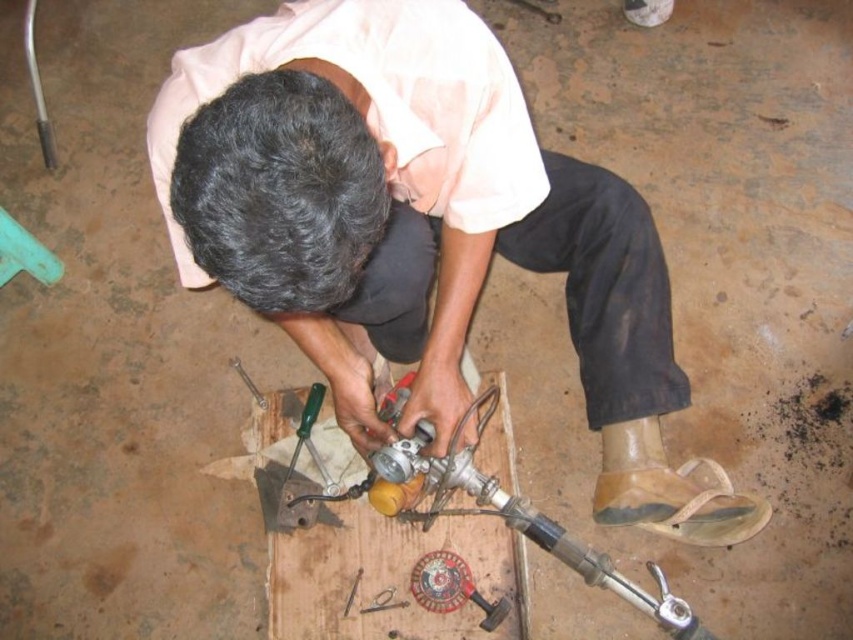
Question: Does matte black shirt at center appear over metallic screwdriver at lower center?

Choices:
 (A) no
 (B) yes

Answer: (B)

Question: Which of the following is the closest to the observer?

Choices:
 (A) (248, 388)
 (B) (230, 211)

Answer: (B)

Question: In this image, where is matte black shirt at center located relative to metallic screwdriver at lower center?

Choices:
 (A) above
 (B) below

Answer: (A)

Question: Can you confirm if matte black shirt at center is positioned above metallic screwdriver at lower center?

Choices:
 (A) no
 (B) yes

Answer: (B)

Question: Which of the following is the farthest from the observer?

Choices:
 (A) matte black shirt at center
 (B) metallic screwdriver at lower center

Answer: (B)